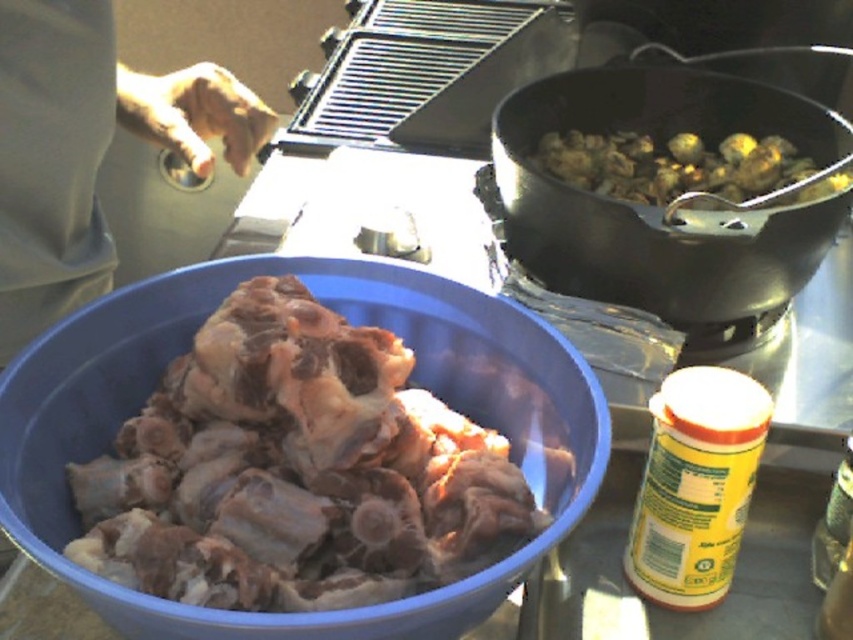
Which is above, black matte wok at upper right or brown skin at upper left?

Positioned higher is black matte wok at upper right.

Between point (653, 269) and point (32, 241), which one is positioned behind?

The point (653, 269) is behind.

I want to click on black matte wok at upper right, so click(671, 202).

Looking at this image, between brown matte bone at center and brown skin at upper left, which one has less height?

brown matte bone at center is shorter.

Is brown matte bone at center above brown skin at upper left?

Actually, brown matte bone at center is below brown skin at upper left.

Locate an element on the screen. Image resolution: width=853 pixels, height=640 pixels. brown matte bone at center is located at coordinates (296, 470).

The image size is (853, 640). I want to click on brown matte bone at center, so click(296, 470).

Which of these two, brown matte bone at center or black matte wok at upper right, stands shorter?

With less height is brown matte bone at center.

Measure the distance between brown matte bone at center and black matte wok at upper right.

The distance of brown matte bone at center from black matte wok at upper right is 12.56 inches.

Where is `brown matte bone at center`? The height and width of the screenshot is (640, 853). brown matte bone at center is located at coordinates (296, 470).